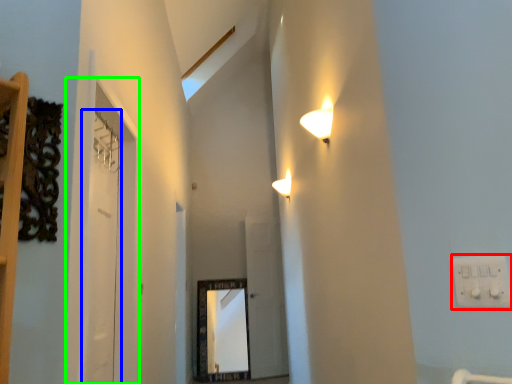
Question: Based on their relative distances, which object is farther from electric outlet (highlighted by a red box)? Choose from door (highlighted by a blue box) and glass door (highlighted by a green box).

Choices:
 (A) door
 (B) glass door

Answer: (A)